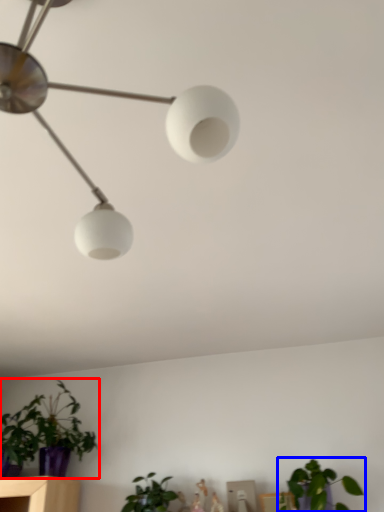
Question: Which object appears closest to the camera in this image, houseplant (highlighted by a red box) or houseplant (highlighted by a blue box)?

Choices:
 (A) houseplant
 (B) houseplant

Answer: (B)